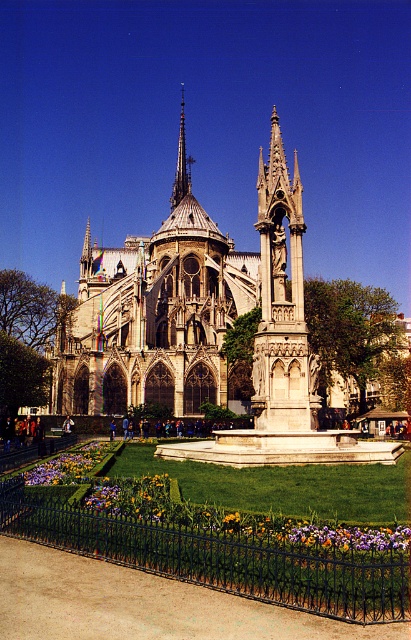
You are a gardener who wants to place a new flower bed between the vibrant multicolored petals at lower center and the polished copper spire at center. Which object should you use as a reference for the width of the new flower bed?

The vibrant multicolored petals at lower center is thinner than the polished copper spire at center, so you should use the polished copper spire at center as the reference for the width of the new flower bed to ensure it is wider than the petals.

You are a visitor standing in front of the cathedral and want to take a photo of the vibrant multicolored petals at lower center without the stone gothic cathedral at center in the background. Which direction should you move to achieve this?

You should move to the left of the vibrant multicolored petals at lower center to avoid the stone gothic cathedral at center, since the cathedral is positioned to the right of the petals.

You are a drone operator planning to fly a drone between the stone gothic cathedral at center and the polished copper spire at center. The drone has a maximum flight distance of 50 meters. Can the drone safely complete the flight between these two structures?

The stone gothic cathedral at center and polished copper spire at center are 54.12 meters apart. Since the drone has a maximum flight distance of 50 meters, it cannot safely complete the flight between them as the distance exceeds its capability.